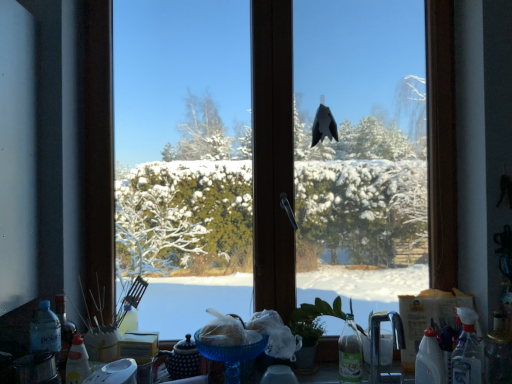
This screenshot has height=384, width=512. Identify the location of transparent plastic spray bottle at lower right, which is the fourth bottle from left to right. (467, 351).

Measure the distance between translucent plastic bottle at lower left, which is the first bottle in left-to-right order, and camera.

They are 4.07 feet apart.

How much space does translucent plastic bottle at lower left, placed as the fourth bottle when sorted from right to left, occupy vertically?

translucent plastic bottle at lower left, placed as the fourth bottle when sorted from right to left, is 25.35 centimeters in height.

Locate an element on the screen. The image size is (512, 384). translucent plastic bottle at lower left, placed as the fourth bottle when sorted from right to left is located at coordinates [77, 362].

In order to face clear plastic bottle at lower right, the third bottle in the right-to-left sequence, should I rotate leftwards or rightwards?

It's best to rotate right around 21.972 degrees.

The image size is (512, 384). What do you see at coordinates (499, 351) in the screenshot?
I see `translucent plastic bottle at lower right, the fifth bottle when ordered from left to right` at bounding box center [499, 351].

Describe the element at coordinates (274, 147) in the screenshot. The width and height of the screenshot is (512, 384). I see `transparent glass window at center` at that location.

What are the coordinates of `transparent glass window at center` in the screenshot? It's located at (274, 147).

The image size is (512, 384). What do you see at coordinates (379, 339) in the screenshot? I see `satin nickel faucet at lower right` at bounding box center [379, 339].

Find the location of a particular element. This screenshot has height=384, width=512. transparent plastic spray bottle at lower right, the second bottle positioned from the right is located at coordinates (467, 351).

Which object is further away from the camera, transparent plastic spray bottle at lower right, which is the fourth bottle from left to right, or satin nickel faucet at lower right?

transparent plastic spray bottle at lower right, which is the fourth bottle from left to right, is further from the camera.

Considering the sizes of transparent plastic spray bottle at lower right, which is the fourth bottle from left to right, and satin nickel faucet at lower right in the image, is transparent plastic spray bottle at lower right, which is the fourth bottle from left to right, taller or shorter than satin nickel faucet at lower right?

Clearly, transparent plastic spray bottle at lower right, which is the fourth bottle from left to right, is shorter compared to satin nickel faucet at lower right.

Is transparent plastic spray bottle at lower right, the second bottle positioned from the right, at the right side of satin nickel faucet at lower right?

Yes.

Which is less distant, (474, 373) or (376, 329)?

Point (474, 373).

Is transparent plastic spray bottle at lower right, the second bottle positioned from the right, oriented away from clear plastic bottle at lower right, the third bottle in the right-to-left sequence?

That's right, transparent plastic spray bottle at lower right, the second bottle positioned from the right, is facing away from clear plastic bottle at lower right, the third bottle in the right-to-left sequence.

Is transparent plastic spray bottle at lower right, which is the fourth bottle from left to right, to the left of clear plastic bottle at lower right, arranged as the third bottle when viewed from the left, from the viewer's perspective?

No.

You are a GUI agent. You are given a task and a screenshot of the screen. Output one action in this format:
    pyautogui.click(x=<x>, y=<y>)
    Task: Click on the 1st bottle behind when counting from the clear plastic bottle at lower right, arranged as the third bottle when viewed from the left
    
    Given the screenshot: What is the action you would take?
    pyautogui.click(x=467, y=351)

From the picture: Considering the relative sizes of transparent plastic spray bottle at lower right, which is the fourth bottle from left to right, and clear plastic bottle at lower right, the third bottle in the right-to-left sequence, in the image provided, is transparent plastic spray bottle at lower right, which is the fourth bottle from left to right, shorter than clear plastic bottle at lower right, the third bottle in the right-to-left sequence,?

No, transparent plastic spray bottle at lower right, which is the fourth bottle from left to right, is not shorter than clear plastic bottle at lower right, the third bottle in the right-to-left sequence.

Does satin nickel faucet at lower right touch translucent plastic bottle at lower right, the fifth bottle when ordered from left to right?

No, satin nickel faucet at lower right is not beside translucent plastic bottle at lower right, the fifth bottle when ordered from left to right.

Find the location of `faucet in front of the translucent plastic bottle at lower right, the fifth bottle when ordered from left to right`. faucet in front of the translucent plastic bottle at lower right, the fifth bottle when ordered from left to right is located at coordinates (379, 339).

From a real-world perspective, between satin nickel faucet at lower right and translucent plastic bottle at lower right, placed as the 1th bottle when sorted from right to left, who is vertically lower?

translucent plastic bottle at lower right, placed as the 1th bottle when sorted from right to left, is physically lower.

Between satin nickel faucet at lower right and translucent plastic bottle at lower right, the fifth bottle when ordered from left to right, which one has more height?

With more height is satin nickel faucet at lower right.

Can you confirm if translucent plastic bottle at lower left, the fifth bottle positioned from the right, is taller than translucent plastic bottle at lower right, placed as the 1th bottle when sorted from right to left?

Yes, translucent plastic bottle at lower left, the fifth bottle positioned from the right, is taller than translucent plastic bottle at lower right, placed as the 1th bottle when sorted from right to left.

Measure the distance between translucent plastic bottle at lower left, the fifth bottle positioned from the right, and translucent plastic bottle at lower right, placed as the 1th bottle when sorted from right to left.

translucent plastic bottle at lower left, the fifth bottle positioned from the right, is 4.54 feet from translucent plastic bottle at lower right, placed as the 1th bottle when sorted from right to left.

From a real-world perspective, does translucent plastic bottle at lower left, the fifth bottle positioned from the right, stand above translucent plastic bottle at lower right, the fifth bottle when ordered from left to right?

Indeed, from a real-world perspective, translucent plastic bottle at lower left, the fifth bottle positioned from the right, stands above translucent plastic bottle at lower right, the fifth bottle when ordered from left to right.

From the image's perspective, would you say translucent plastic bottle at lower left, which is the first bottle in left-to-right order, is positioned over translucent plastic bottle at lower right, the fifth bottle when ordered from left to right?

Yes, from the image's perspective, translucent plastic bottle at lower left, which is the first bottle in left-to-right order, is over translucent plastic bottle at lower right, the fifth bottle when ordered from left to right.

From the image's perspective, is clear plastic bottle at lower right, the third bottle in the right-to-left sequence, under translucent plastic bottle at lower left, which is counted as the second bottle, starting from the left?

No, from the image's perspective, clear plastic bottle at lower right, the third bottle in the right-to-left sequence, is not beneath translucent plastic bottle at lower left, which is counted as the second bottle, starting from the left.

Based on their sizes in the image, would you say clear plastic bottle at lower right, arranged as the third bottle when viewed from the left, is bigger or smaller than translucent plastic bottle at lower left, placed as the fourth bottle when sorted from right to left?

clear plastic bottle at lower right, arranged as the third bottle when viewed from the left, is bigger than translucent plastic bottle at lower left, placed as the fourth bottle when sorted from right to left.

From a real-world perspective, is clear plastic bottle at lower right, the third bottle in the right-to-left sequence, physically above translucent plastic bottle at lower left, which is counted as the second bottle, starting from the left?

Correct, in the physical world, clear plastic bottle at lower right, the third bottle in the right-to-left sequence, is higher than translucent plastic bottle at lower left, which is counted as the second bottle, starting from the left.

Does point (68, 367) come in front of point (441, 383)?

No, it is not.

Based on their positions, is translucent plastic bottle at lower left, which is counted as the second bottle, starting from the left, located to the left or right of clear plastic bottle at lower right, the third bottle in the right-to-left sequence?

From the image, it's evident that translucent plastic bottle at lower left, which is counted as the second bottle, starting from the left, is to the left of clear plastic bottle at lower right, the third bottle in the right-to-left sequence.

Do you think translucent plastic bottle at lower left, placed as the fourth bottle when sorted from right to left, is within clear plastic bottle at lower right, the third bottle in the right-to-left sequence, or outside of it?

translucent plastic bottle at lower left, placed as the fourth bottle when sorted from right to left, is spatially situated outside clear plastic bottle at lower right, the third bottle in the right-to-left sequence.

From the image's perspective, is translucent plastic bottle at lower left, which is counted as the second bottle, starting from the left, under clear plastic bottle at lower right, arranged as the third bottle when viewed from the left?

Correct, translucent plastic bottle at lower left, which is counted as the second bottle, starting from the left, appears lower than clear plastic bottle at lower right, arranged as the third bottle when viewed from the left, in the image.

Which object is further away from the camera, translucent plastic bottle at lower left, the fifth bottle positioned from the right, or transparent plastic spray bottle at lower right, which is the fourth bottle from left to right?

Positioned behind is translucent plastic bottle at lower left, the fifth bottle positioned from the right.

From a real-world perspective, is translucent plastic bottle at lower left, which is the first bottle in left-to-right order, above or below transparent plastic spray bottle at lower right, the second bottle positioned from the right?

Clearly, from a real-world perspective, translucent plastic bottle at lower left, which is the first bottle in left-to-right order, is above transparent plastic spray bottle at lower right, the second bottle positioned from the right.

In the scene shown: Considering the sizes of objects translucent plastic bottle at lower left, which is the first bottle in left-to-right order, and transparent plastic spray bottle at lower right, which is the fourth bottle from left to right, in the image provided, who is thinner, translucent plastic bottle at lower left, which is the first bottle in left-to-right order, or transparent plastic spray bottle at lower right, which is the fourth bottle from left to right,?

With smaller width is transparent plastic spray bottle at lower right, which is the fourth bottle from left to right.

Between point (38, 348) and point (452, 380), which one is positioned behind?

Point (38, 348)

You are a GUI agent. You are given a task and a screenshot of the screen. Output one action in this format:
    pyautogui.click(x=<x>, y=<y>)
    Task: Click on the faucet on the left of transparent plastic spray bottle at lower right, which is the fourth bottle from left to right
    The width and height of the screenshot is (512, 384).
    Given the screenshot: What is the action you would take?
    pyautogui.click(x=379, y=339)

From the clear plastic bottle at lower right, arranged as the third bottle when viewed from the left, count 1st bottle to the right and point to it. Please provide its 2D coordinates.

[(467, 351)]

From the image, which object appears to be farther from transparent plastic spray bottle at lower right, which is the fourth bottle from left to right, translucent plastic bottle at lower left, which is the first bottle in left-to-right order, or clear plastic bottle at lower right, arranged as the third bottle when viewed from the left?

translucent plastic bottle at lower left, which is the first bottle in left-to-right order, lies further to transparent plastic spray bottle at lower right, which is the fourth bottle from left to right, than the other object.

Which object lies nearer to the anchor point translucent plastic bottle at lower right, the fifth bottle when ordered from left to right, transparent plastic spray bottle at lower right, which is the fourth bottle from left to right, or satin nickel faucet at lower right?

Among the two, transparent plastic spray bottle at lower right, which is the fourth bottle from left to right, is located nearer to translucent plastic bottle at lower right, the fifth bottle when ordered from left to right.

Considering their positions, is translucent plastic bottle at lower left, the fifth bottle positioned from the right, positioned closer to satin nickel faucet at lower right than translucent plastic bottle at lower left, which is counted as the second bottle, starting from the left?

The object closer to satin nickel faucet at lower right is translucent plastic bottle at lower left, which is counted as the second bottle, starting from the left.

Based on their spatial positions, is satin nickel faucet at lower right or clear plastic bottle at lower right, arranged as the third bottle when viewed from the left, closer to transparent glass window at center?

Based on the image, satin nickel faucet at lower right appears to be nearer to transparent glass window at center.

When comparing their distances from transparent plastic spray bottle at lower right, which is the fourth bottle from left to right, does clear plastic bottle at lower right, the third bottle in the right-to-left sequence, or translucent plastic bottle at lower left, placed as the fourth bottle when sorted from right to left, seem further?

translucent plastic bottle at lower left, placed as the fourth bottle when sorted from right to left, is positioned further to the anchor transparent plastic spray bottle at lower right, which is the fourth bottle from left to right.

Based on their spatial positions, is translucent plastic bottle at lower right, placed as the 1th bottle when sorted from right to left, or transparent plastic spray bottle at lower right, which is the fourth bottle from left to right, closer to translucent plastic bottle at lower left, which is the first bottle in left-to-right order?

transparent plastic spray bottle at lower right, which is the fourth bottle from left to right, is closer to translucent plastic bottle at lower left, which is the first bottle in left-to-right order.

Based on their spatial positions, is transparent plastic spray bottle at lower right, the second bottle positioned from the right, or clear plastic bottle at lower right, arranged as the third bottle when viewed from the left, closer to translucent plastic bottle at lower left, which is counted as the second bottle, starting from the left?

clear plastic bottle at lower right, arranged as the third bottle when viewed from the left, is positioned closer to the anchor translucent plastic bottle at lower left, which is counted as the second bottle, starting from the left.

From the image, which object appears to be farther from clear plastic bottle at lower right, arranged as the third bottle when viewed from the left, translucent plastic bottle at lower left, which is the first bottle in left-to-right order, or satin nickel faucet at lower right?

translucent plastic bottle at lower left, which is the first bottle in left-to-right order, is further to clear plastic bottle at lower right, arranged as the third bottle when viewed from the left.

Find the location of `window between translucent plastic bottle at lower left, the fifth bottle positioned from the right, and transparent plastic spray bottle at lower right, the second bottle positioned from the right, in the horizontal direction`. window between translucent plastic bottle at lower left, the fifth bottle positioned from the right, and transparent plastic spray bottle at lower right, the second bottle positioned from the right, in the horizontal direction is located at coordinates (274, 147).

Image resolution: width=512 pixels, height=384 pixels. In order to click on faucet between translucent plastic bottle at lower left, which is the first bottle in left-to-right order, and transparent plastic spray bottle at lower right, which is the fourth bottle from left to right in this screenshot , I will do `click(379, 339)`.

Locate an element on the screen. bottle between satin nickel faucet at lower right and transparent plastic spray bottle at lower right, the second bottle positioned from the right is located at coordinates (429, 360).

The image size is (512, 384). What are the coordinates of `faucet that lies between transparent glass window at center and clear plastic bottle at lower right, arranged as the third bottle when viewed from the left, from top to bottom` in the screenshot? It's located at (379, 339).